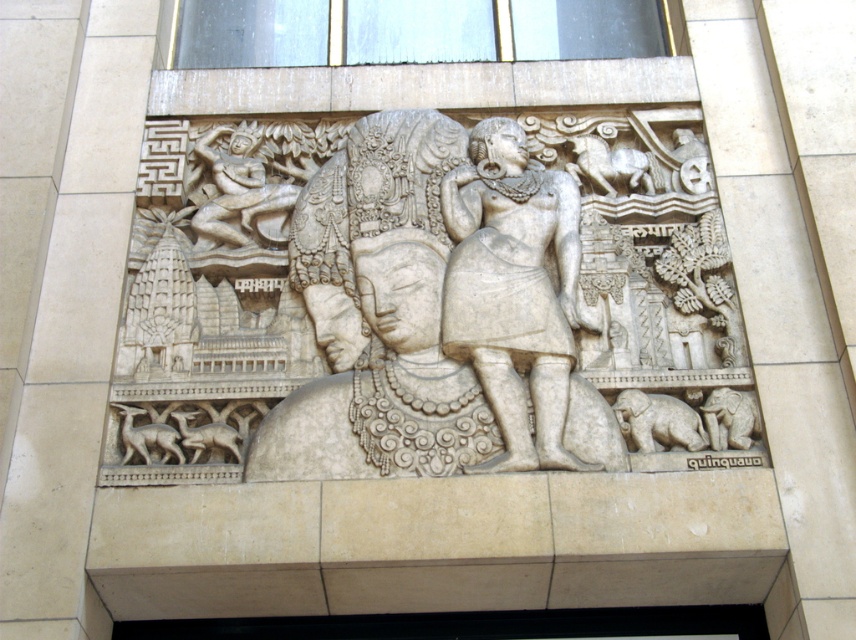
Question: Is the position of white stone carving at center less distant than that of white stone figure at center?

Choices:
 (A) no
 (B) yes

Answer: (A)

Question: Does white stone carving at center lie behind white stone figure at center?

Choices:
 (A) yes
 (B) no

Answer: (A)

Question: Among these objects, which one is nearest to the camera?

Choices:
 (A) white stone figure at center
 (B) white stone carving at center

Answer: (A)

Question: Is white stone carving at center closer to the viewer compared to white stone figure at center?

Choices:
 (A) no
 (B) yes

Answer: (A)